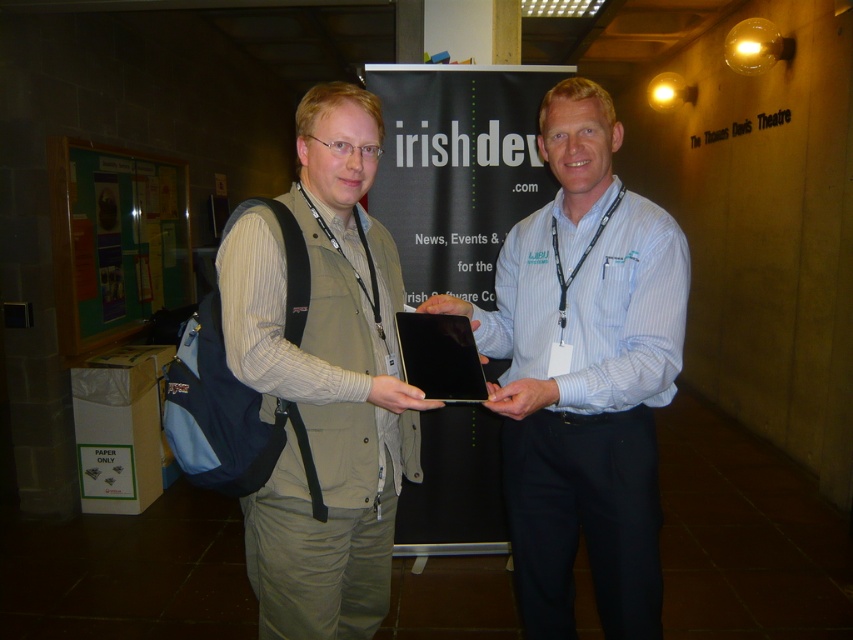
Question: Can you confirm if light blue striped shirt at center is bigger than matte khaki vest at center?

Choices:
 (A) yes
 (B) no

Answer: (A)

Question: Which point is farther to the camera?

Choices:
 (A) (355, 426)
 (B) (601, 456)

Answer: (B)

Question: Which point is closer to the camera?

Choices:
 (A) light blue striped shirt at center
 (B) matte khaki vest at center

Answer: (B)

Question: Does light blue striped shirt at center come in front of matte khaki vest at center?

Choices:
 (A) no
 (B) yes

Answer: (A)

Question: Among these objects, which one is farthest from the camera?

Choices:
 (A) matte khaki vest at center
 (B) light blue striped shirt at center

Answer: (B)

Question: Observing the image, what is the correct spatial positioning of light blue striped shirt at center in reference to matte khaki vest at center?

Choices:
 (A) right
 (B) left

Answer: (A)